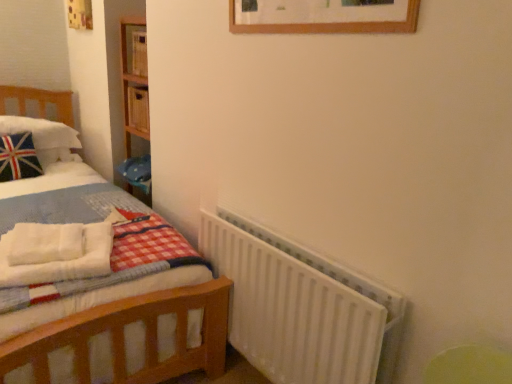
Identify the location of blank space above white fluffy blanket at left (from a real-world perspective). Image resolution: width=512 pixels, height=384 pixels. (45, 240).